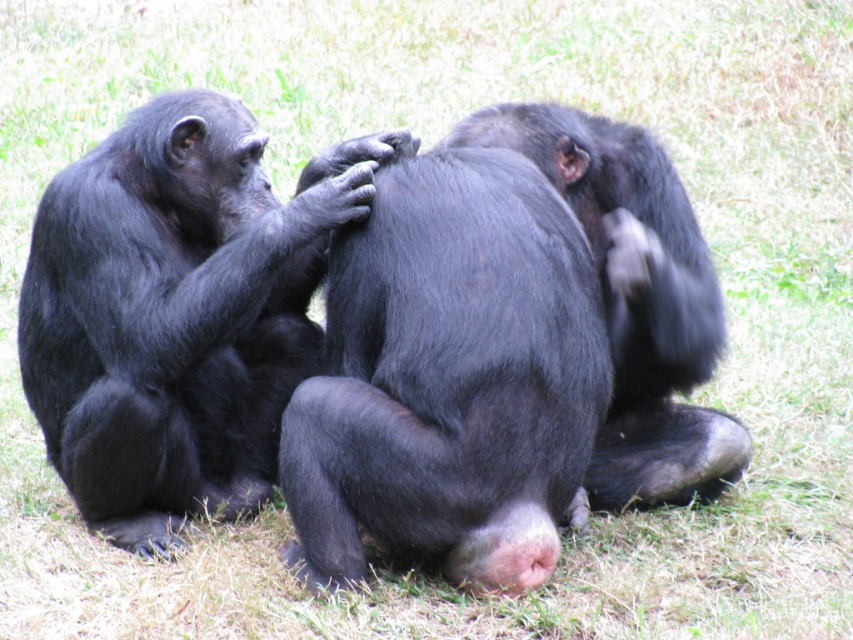
Between shiny black monkey at center and shiny black fur at center, which one has less height?

shiny black fur at center

In the scene shown: Is shiny black monkey at center behind shiny black fur at center?

Yes, shiny black monkey at center is behind shiny black fur at center.

Find the location of `shiny black monkey at center`. shiny black monkey at center is located at coordinates (177, 310).

At what (x,y) coordinates should I click in order to perform the action: click on black matte fur at center. Please return your answer as a coordinate pair (x, y). This screenshot has width=853, height=640. Looking at the image, I should click on (450, 378).

Which is more to the left, black matte fur at center or shiny black fur at center?

black matte fur at center

Does point (415, 388) come closer to viewer compared to point (657, 276)?

Yes.

Where is `black matte fur at center`? black matte fur at center is located at coordinates (450, 378).

Can you confirm if black matte fur at center is positioned to the right of shiny black monkey at center?

Yes, black matte fur at center is to the right of shiny black monkey at center.

Between black matte fur at center and shiny black monkey at center, which one appears on the right side from the viewer's perspective?

Positioned to the right is black matte fur at center.

Based on the photo, who is more forward, [427,316] or [161,196]?

Positioned in front is point [427,316].

What are the coordinates of `black matte fur at center` in the screenshot? It's located at (450, 378).